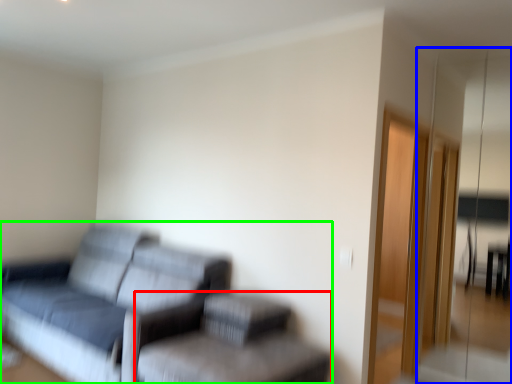
Question: Considering the real-world distances, which object is closest to swivel chair (highlighted by a red box)? glass door (highlighted by a blue box) or studio couch (highlighted by a green box).

Choices:
 (A) glass door
 (B) studio couch

Answer: (B)